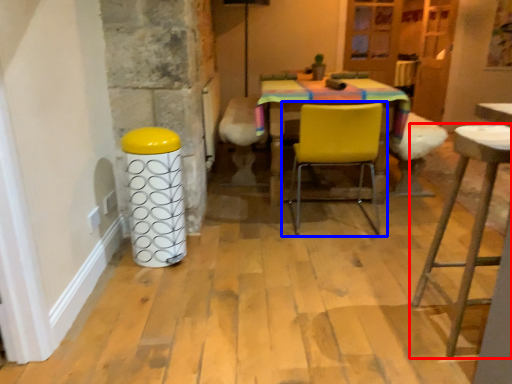
Question: Which object appears farthest to the camera in this image, stool (highlighted by a red box) or chair (highlighted by a blue box)?

Choices:
 (A) stool
 (B) chair

Answer: (B)